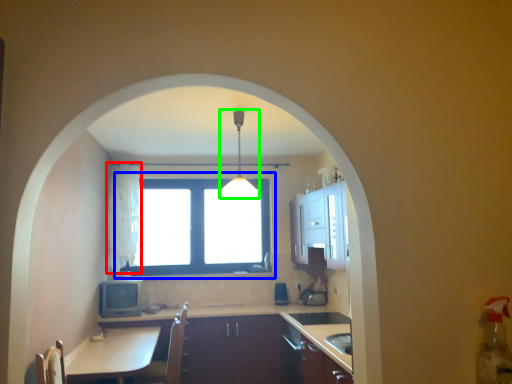
Question: Estimate the real-world distances between objects in this image. Which object is farther from curtain (highlighted by a red box), window (highlighted by a blue box) or light fixture (highlighted by a green box)?

Choices:
 (A) window
 (B) light fixture

Answer: (B)